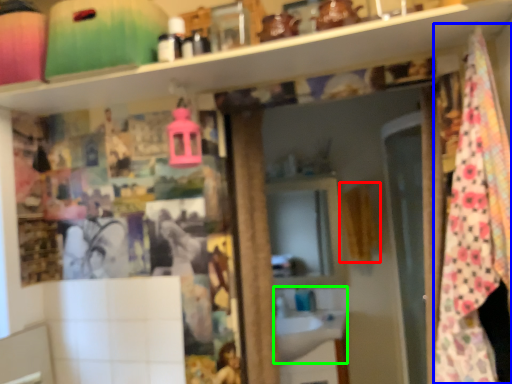
Question: Estimate the real-world distances between objects in this image. Which object is closer to curtain (highlighted by a red box), blanket (highlighted by a blue box) or sink (highlighted by a green box)?

Choices:
 (A) blanket
 (B) sink

Answer: (B)